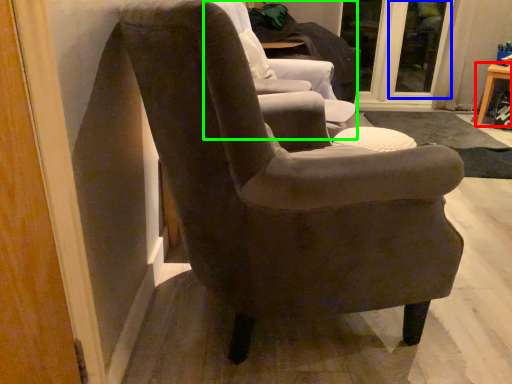
Question: Which object is positioned farthest from table (highlighted by a red box)? Select from glass door (highlighted by a blue box) and chair (highlighted by a green box).

Choices:
 (A) glass door
 (B) chair

Answer: (B)